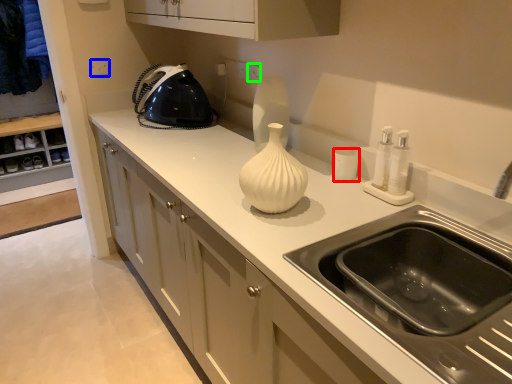
Question: Estimate the real-world distances between objects in this image. Which object is farther from kitchen appliance (highlighted by a red box), electric outlet (highlighted by a blue box) or electric outlet (highlighted by a green box)?

Choices:
 (A) electric outlet
 (B) electric outlet

Answer: (A)